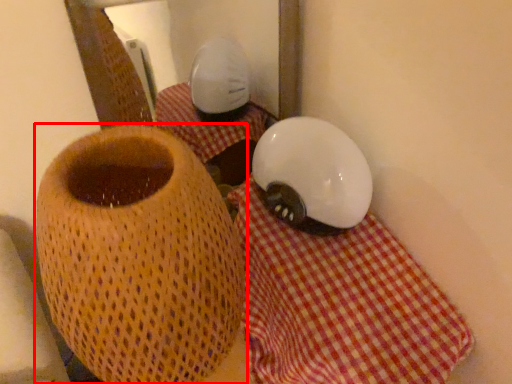
Question: From the image's perspective, considering the relative positions of vase (annotated by the red box) and tablecloth in the image provided, where is vase (annotated by the red box) located with respect to the staircase?

Choices:
 (A) above
 (B) below

Answer: (A)